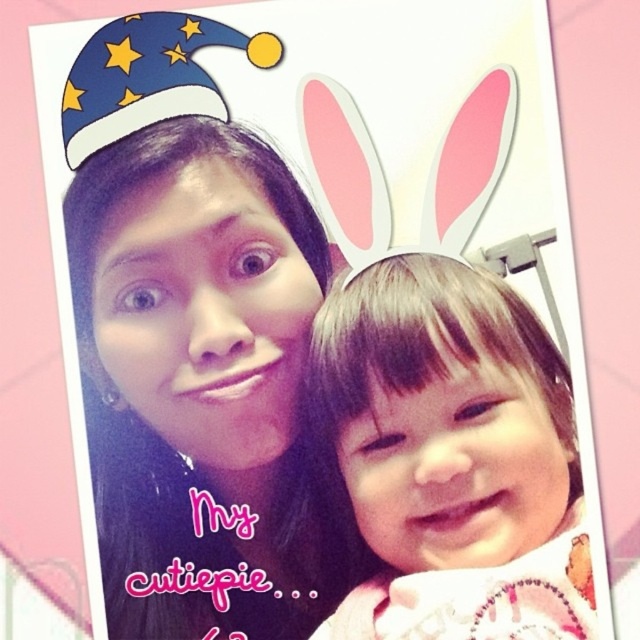
You are standing 1 meter away from the image. There is a point at coordinates point (145, 390). Can you reach it with your hand if you extend it fully?

The distance of point (145, 390) from viewer is 60.98 centimeters. Since you are standing 1 meter away, the total distance is 160.98 centimeters. The average human arm length is about 70 centimeters, so you cannot reach the point with your hand.

You are a photographer trying to adjust the lighting for a photo shoot. You notice the matte black hair at center and the smooth skin baby at center. Which object is covering the other one?

The matte black hair at center is positioned over the smooth skin baby at center, so it is covering the baby.